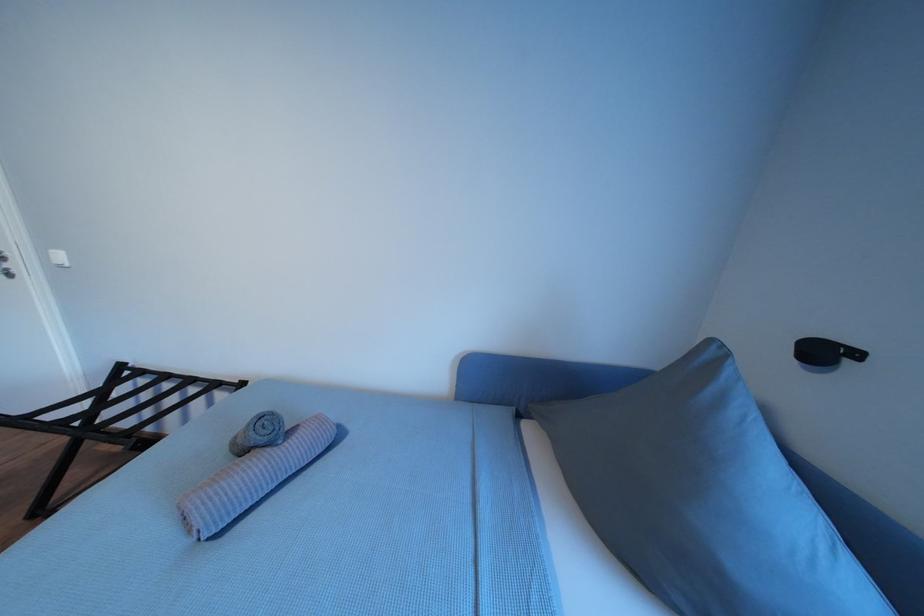
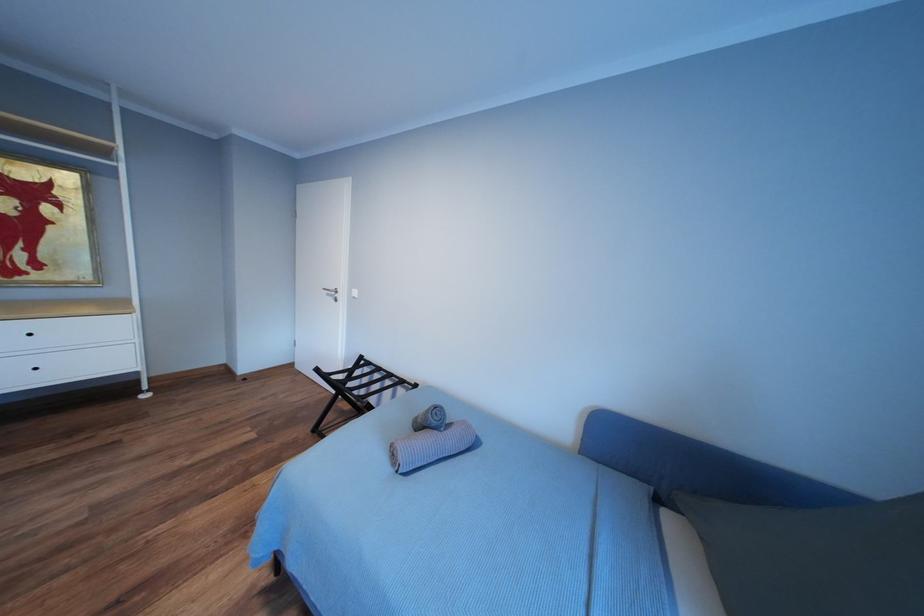
Question: The images are taken continuously from a first-person perspective. In which direction is your viewpoint rotating?

Choices:
 (A) Left
 (B) Right
 (C) Up
 (D) Down

Answer: (A)